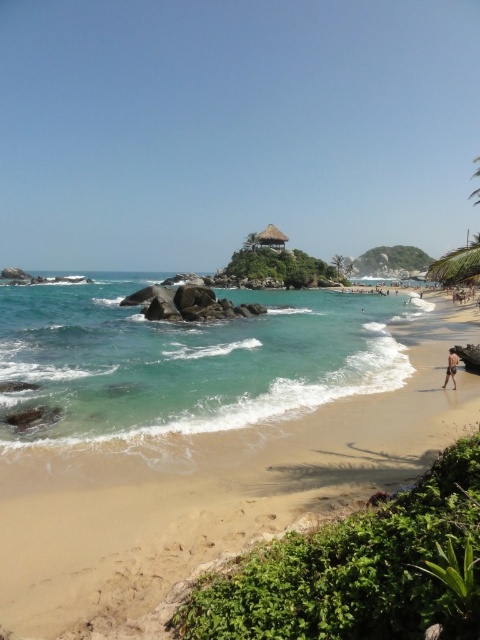
Consider the image. Who is positioned more to the right, sandy beach at lower left or brown thatched hut at center?

Positioned to the right is brown thatched hut at center.

Who is more distant from viewer, [278,436] or [283,244]?

Positioned behind is point [283,244].

Between point (85, 419) and point (268, 236), which one is positioned in front?

Point (85, 419)

The width and height of the screenshot is (480, 640). Find the location of `sandy beach at lower left`. sandy beach at lower left is located at coordinates (203, 440).

Is sandy beach at lower left shorter than brown sandy person at lower right?

Incorrect, sandy beach at lower left's height does not fall short of brown sandy person at lower right's.

Can you confirm if sandy beach at lower left is wider than brown sandy person at lower right?

Yes.

Where is `sandy beach at lower left`? sandy beach at lower left is located at coordinates (203, 440).

Locate an element on the screen. This screenshot has height=640, width=480. sandy beach at lower left is located at coordinates (203, 440).

Is clear blue water at center bigger than brown thatched hut at center?

Correct, clear blue water at center is larger in size than brown thatched hut at center.

Consider the image. Between clear blue water at center and brown thatched hut at center, which one has less height?

brown thatched hut at center

The image size is (480, 640). Describe the element at coordinates (188, 358) in the screenshot. I see `clear blue water at center` at that location.

The width and height of the screenshot is (480, 640). I want to click on clear blue water at center, so click(188, 358).